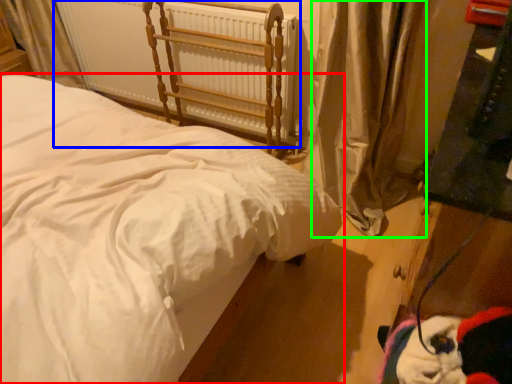
Question: Which object is positioned closest to bed (highlighted by a red box)? Select from radiator (highlighted by a blue box) and curtain (highlighted by a green box).

Choices:
 (A) radiator
 (B) curtain

Answer: (B)